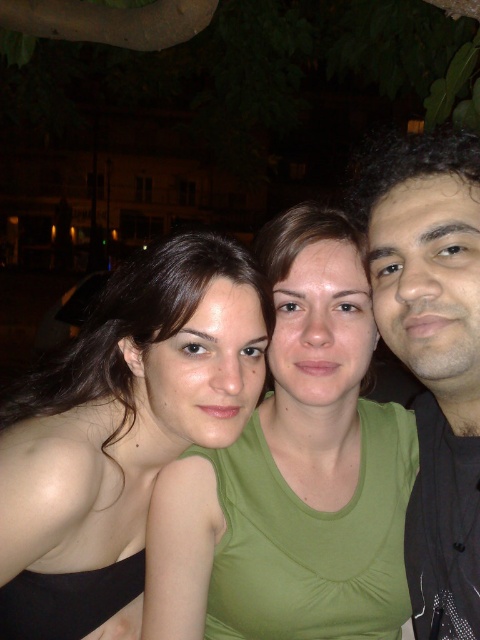
Question: Which of the following is the closest to the observer?

Choices:
 (A) green matte tank top at center
 (B) matte black tank top at center
 (C) black matte shirt at right

Answer: (C)

Question: Among these points, which one is farthest from the camera?

Choices:
 (A) (354, 289)
 (B) (371, 232)
 (C) (49, 609)

Answer: (C)

Question: Considering the relative positions of green matte tank top at center and matte black tank top at center in the image provided, where is green matte tank top at center located with respect to matte black tank top at center?

Choices:
 (A) right
 (B) left

Answer: (A)

Question: Can you confirm if matte black tank top at center is wider than black matte shirt at right?

Choices:
 (A) no
 (B) yes

Answer: (B)

Question: Can you confirm if matte black tank top at center is thinner than black matte shirt at right?

Choices:
 (A) yes
 (B) no

Answer: (B)

Question: Which object is farther from the camera taking this photo?

Choices:
 (A) black matte shirt at right
 (B) green matte tank top at center

Answer: (B)